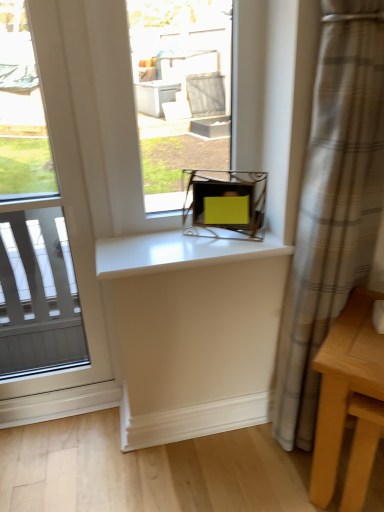
Question: From the image's perspective, is clear glass window at left, which appears as the second window when viewed from the right, below matte yellow box at center, which is the 1th window from right to left?

Choices:
 (A) yes
 (B) no

Answer: (A)

Question: Considering the relative sizes of clear glass window at left, positioned as the 1th window in left-to-right order, and matte yellow box at center, which is the 2th window from left to right, in the image provided, is clear glass window at left, positioned as the 1th window in left-to-right order, thinner than matte yellow box at center, which is the 2th window from left to right,?

Choices:
 (A) yes
 (B) no

Answer: (B)

Question: Considering the relative positions of clear glass window at left, positioned as the 1th window in left-to-right order, and matte yellow box at center, which is the 1th window from right to left, in the image provided, is clear glass window at left, positioned as the 1th window in left-to-right order, behind matte yellow box at center, which is the 1th window from right to left,?

Choices:
 (A) no
 (B) yes

Answer: (A)

Question: Can you confirm if clear glass window at left, which appears as the second window when viewed from the right, is positioned to the left of matte yellow box at center, which is the 2th window from left to right?

Choices:
 (A) yes
 (B) no

Answer: (A)

Question: Is clear glass window at left, which appears as the second window when viewed from the right, positioned beyond the bounds of matte yellow box at center, which is the 1th window from right to left?

Choices:
 (A) no
 (B) yes

Answer: (B)

Question: Is clear glass window at left, positioned as the 1th window in left-to-right order, turned away from matte yellow box at center, which is the 2th window from left to right?

Choices:
 (A) no
 (B) yes

Answer: (A)

Question: Is white glossy counter top at center outside of matte yellow box at center, which is the 2th window from left to right?

Choices:
 (A) no
 (B) yes

Answer: (B)

Question: Is white glossy counter top at center oriented towards matte yellow box at center, which is the 1th window from right to left?

Choices:
 (A) yes
 (B) no

Answer: (B)

Question: Is white glossy counter top at center with matte yellow box at center, which is the 2th window from left to right?

Choices:
 (A) yes
 (B) no

Answer: (B)

Question: From the image's perspective, would you say white glossy counter top at center is positioned over matte yellow box at center, which is the 2th window from left to right?

Choices:
 (A) no
 (B) yes

Answer: (A)

Question: Can you confirm if white glossy counter top at center is taller than matte yellow box at center, which is the 2th window from left to right?

Choices:
 (A) yes
 (B) no

Answer: (B)

Question: From a real-world perspective, is white glossy counter top at center located beneath matte yellow box at center, which is the 1th window from right to left?

Choices:
 (A) no
 (B) yes

Answer: (B)

Question: From the image's perspective, is plaid fabric curtain at right above matte yellow box at center, which is the 1th window from right to left?

Choices:
 (A) no
 (B) yes

Answer: (A)